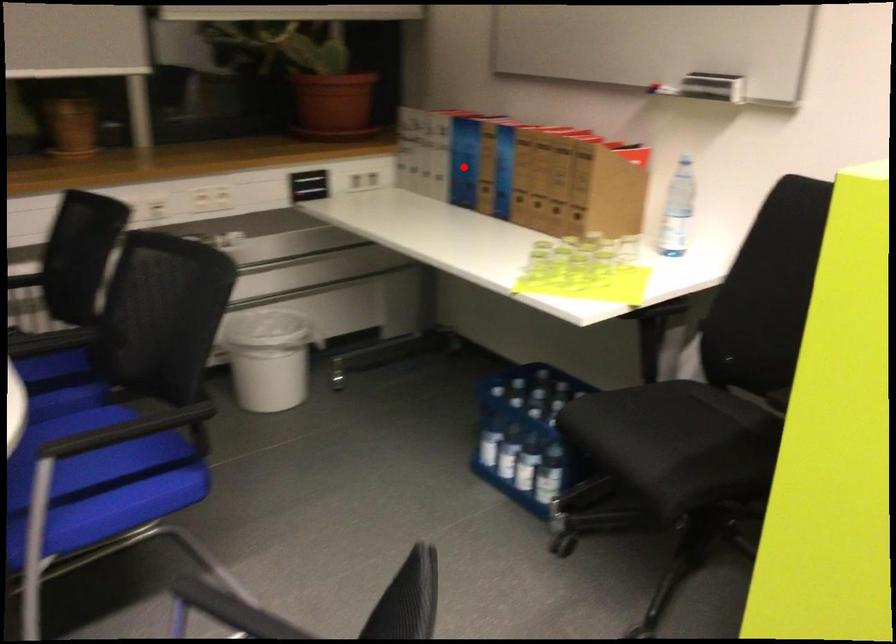
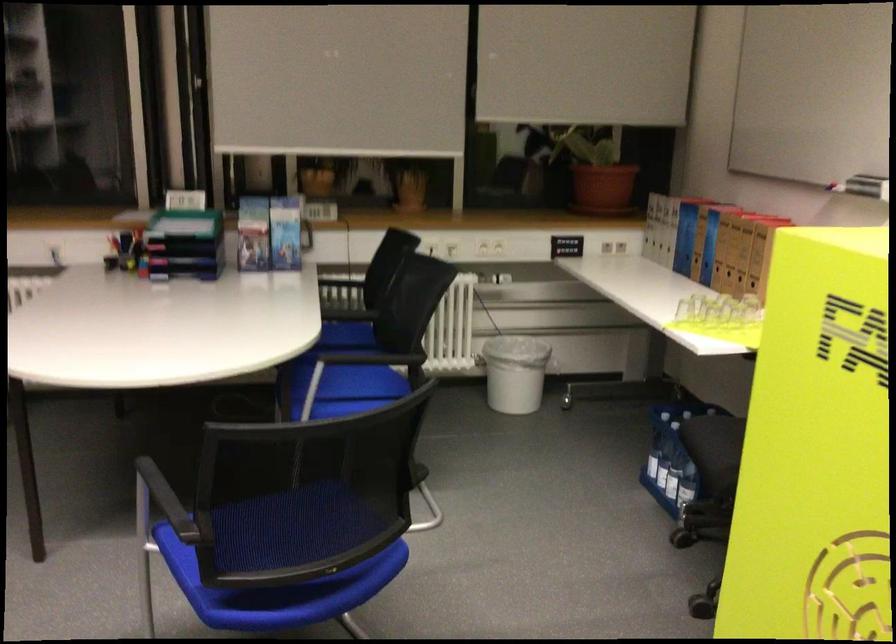
Find the pixel in the second image that matches the highlighted location in the first image.

(685, 238)